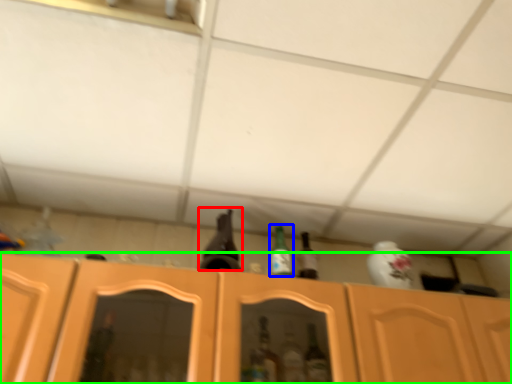
Question: Estimate the real-world distances between objects in this image. Which object is closer to beer bottle (highlighted by a red box), bottle (highlighted by a blue box) or cabinetry (highlighted by a green box)?

Choices:
 (A) bottle
 (B) cabinetry

Answer: (A)